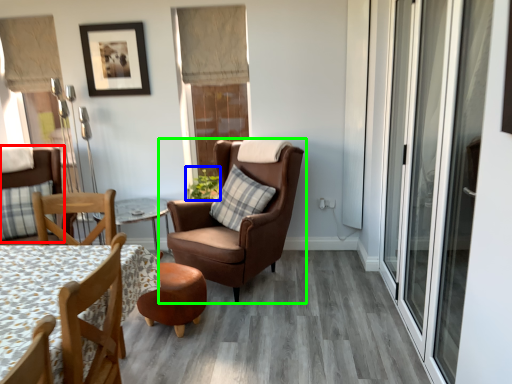
Question: Considering the real-world distances, which object is farthest from chair (highlighted by a red box)? plant (highlighted by a blue box) or chair (highlighted by a green box)?

Choices:
 (A) plant
 (B) chair

Answer: (B)